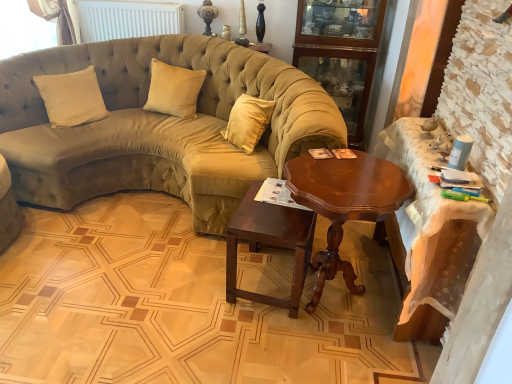
Question: From the image's perspective, is shiny brown wood coffee table at center above wooden table at right, the first table in the right-to-left sequence?

Choices:
 (A) yes
 (B) no

Answer: (B)

Question: Considering the relative sizes of shiny brown wood coffee table at center and wooden table at right, arranged as the 2th table when viewed from the left, in the image provided, is shiny brown wood coffee table at center taller than wooden table at right, arranged as the 2th table when viewed from the left,?

Choices:
 (A) yes
 (B) no

Answer: (B)

Question: From a real-world perspective, is shiny brown wood coffee table at center under wooden table at right, arranged as the 2th table when viewed from the left?

Choices:
 (A) yes
 (B) no

Answer: (A)

Question: Are shiny brown wood coffee table at center and wooden table at right, the first table in the right-to-left sequence, beside each other?

Choices:
 (A) no
 (B) yes

Answer: (A)

Question: Does shiny brown wood coffee table at center have a lesser width compared to wooden table at right, arranged as the 2th table when viewed from the left?

Choices:
 (A) yes
 (B) no

Answer: (B)

Question: Considering the positions of wooden table at right, the first table in the right-to-left sequence, and mahogany wood side table at center, marked as the 1th table in a left-to-right arrangement, in the image, is wooden table at right, the first table in the right-to-left sequence, wider or thinner than mahogany wood side table at center, marked as the 1th table in a left-to-right arrangement,?

Choices:
 (A) thin
 (B) wide

Answer: (A)

Question: In the image, is wooden table at right, arranged as the 2th table when viewed from the left, on the left side or the right side of mahogany wood side table at center, acting as the second table starting from the right?

Choices:
 (A) left
 (B) right

Answer: (B)

Question: From their relative heights in the image, would you say wooden table at right, arranged as the 2th table when viewed from the left, is taller or shorter than mahogany wood side table at center, acting as the second table starting from the right?

Choices:
 (A) short
 (B) tall

Answer: (B)

Question: Choose the correct answer: Is wooden table at right, arranged as the 2th table when viewed from the left, inside mahogany wood side table at center, acting as the second table starting from the right, or outside it?

Choices:
 (A) inside
 (B) outside

Answer: (B)

Question: In the image, is white matte radiator at upper center on the left side or the right side of wooden cabinet at upper right?

Choices:
 (A) left
 (B) right

Answer: (A)

Question: Is white matte radiator at upper center spatially inside wooden cabinet at upper right, or outside of it?

Choices:
 (A) inside
 (B) outside

Answer: (B)

Question: In terms of height, does white matte radiator at upper center look taller or shorter compared to wooden cabinet at upper right?

Choices:
 (A) tall
 (B) short

Answer: (B)

Question: Considering the positions of white matte radiator at upper center and wooden cabinet at upper right in the image, is white matte radiator at upper center bigger or smaller than wooden cabinet at upper right?

Choices:
 (A) small
 (B) big

Answer: (A)

Question: Is satin beige pillow at center, positioned as the second pillow in left-to-right order, bigger or smaller than beige velvet pillow at center, the 2th pillow when ordered from right to left?

Choices:
 (A) big
 (B) small

Answer: (A)

Question: Considering their positions, is satin beige pillow at center, positioned as the second pillow in left-to-right order, located in front of or behind beige velvet pillow at center, acting as the first pillow starting from the left?

Choices:
 (A) front
 (B) behind

Answer: (B)